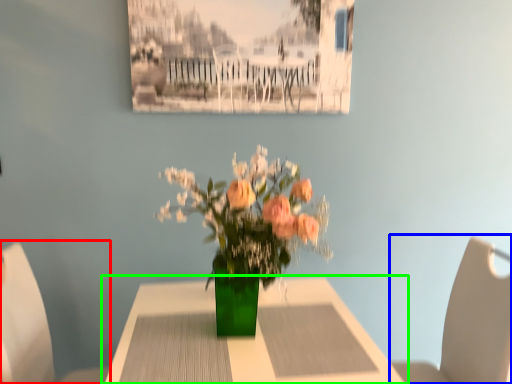
Question: Considering the real-world distances, which object is farthest from chair (highlighted by a red box)? chair (highlighted by a blue box) or table (highlighted by a green box)?

Choices:
 (A) chair
 (B) table

Answer: (A)